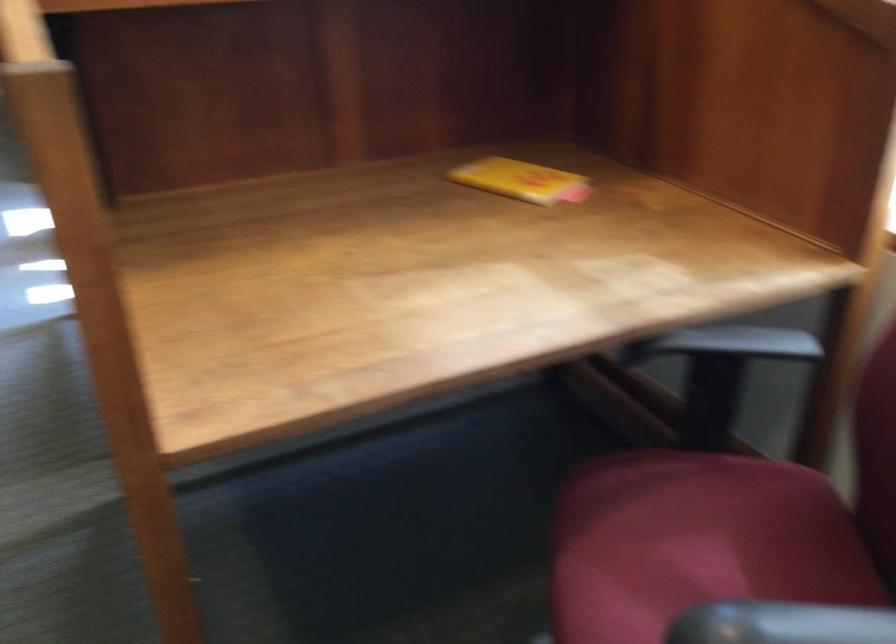
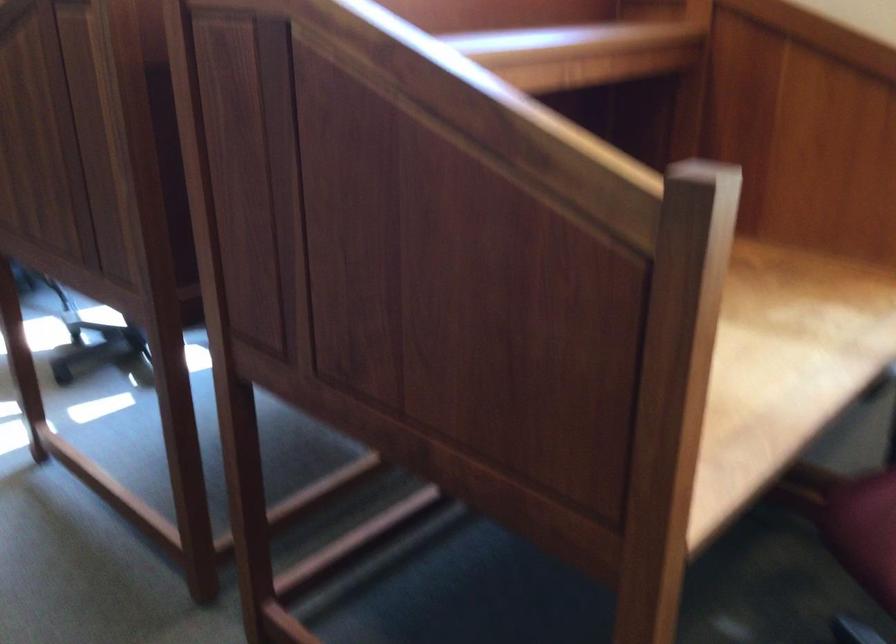
Question: What movement of the cameraman would produce the second image?

Choices:
 (A) Left
 (B) Right
 (C) Forward
 (D) Backward

Answer: (A)